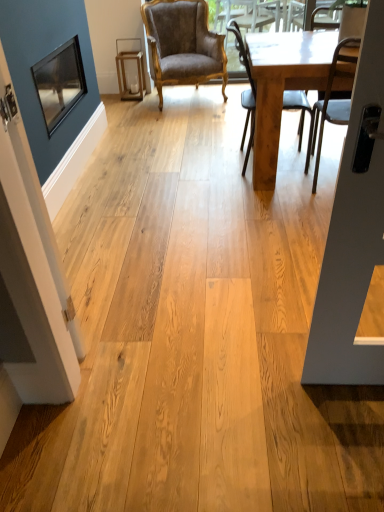
Image resolution: width=384 pixels, height=512 pixels. Find the location of `vacant space in between velvet brown armchair at center, arranged as the third chair when viewed from the front, and matte black screen door at left`. vacant space in between velvet brown armchair at center, arranged as the third chair when viewed from the front, and matte black screen door at left is located at coordinates (161, 172).